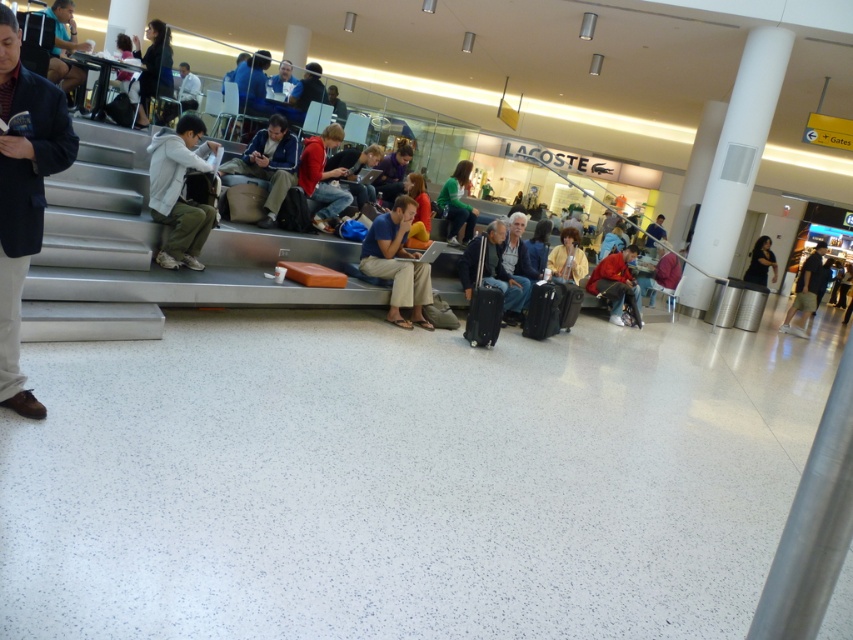
Question: Does black hardshell suitcase at center have a lesser width compared to dark gray pants at center?

Choices:
 (A) no
 (B) yes

Answer: (B)

Question: Is light blue jeans at center positioned at the back of matte blue shirt at center?

Choices:
 (A) yes
 (B) no

Answer: (B)

Question: Where is blue denim jacket at center located in relation to dark gray pants at center in the image?

Choices:
 (A) left
 (B) right

Answer: (A)

Question: Which object is farther from the camera taking this photo?

Choices:
 (A) dark gray pants at center
 (B) black hardshell suitcase at center
 (C) blue denim jacket at center
 (D) matte yellow jacket at center

Answer: (A)

Question: Which of these objects is positioned farthest from the black fabric dress at lower right?

Choices:
 (A) matte blue shirt at center
 (B) dark blue blazer at left
 (C) black hardshell suitcase at center
 (D) black matte suitcase at center

Answer: (B)

Question: Which point appears closest to the camera in this image?

Choices:
 (A) (547, 285)
 (B) (161, 182)

Answer: (B)